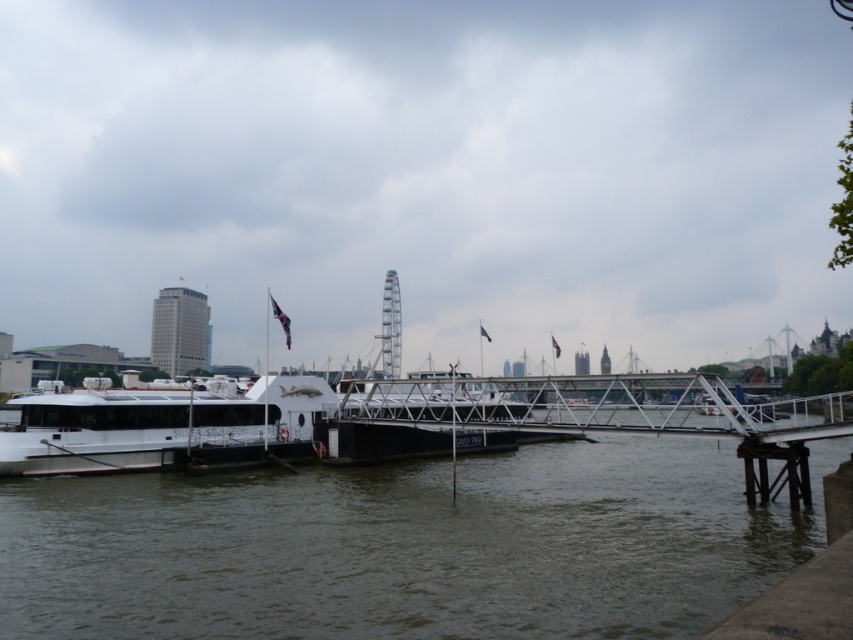
Question: Which of the following is the farthest from the observer?

Choices:
 (A) brown water at lower left
 (B) white matte boat at left

Answer: (B)

Question: Can you confirm if brown water at lower left is thinner than white matte boat at left?

Choices:
 (A) yes
 (B) no

Answer: (B)

Question: Does brown water at lower left appear on the left side of white matte boat at left?

Choices:
 (A) no
 (B) yes

Answer: (A)

Question: Which of the following is the closest to the observer?

Choices:
 (A) (19, 465)
 (B) (151, 490)

Answer: (B)

Question: From the image, what is the correct spatial relationship of brown water at lower left in relation to white matte boat at left?

Choices:
 (A) below
 (B) above

Answer: (A)